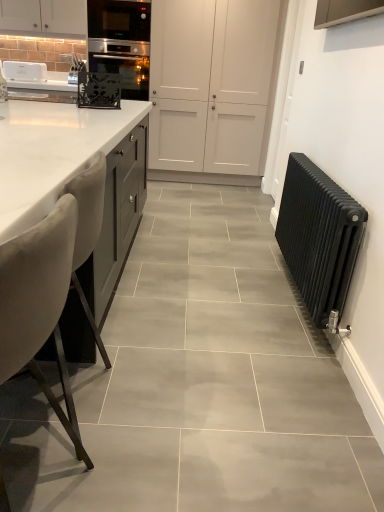
In order to face velvet beige chair at left, should I rotate leftwards or rightwards?

Turn left by 23.535 degrees to look at velvet beige chair at left.

What is the approximate width of white marble countertop at left?

9.86 feet.

The width and height of the screenshot is (384, 512). In order to click on velvet beige chair at left in this screenshot , I will do `click(37, 298)`.

Is white marble countertop at left inside or outside of velvet beige chair at left?

The correct answer is: outside.

Can you confirm if white marble countertop at left is thinner than velvet beige chair at left?

No.

Which is more distant, (195, 142) or (73, 133)?

The point (195, 142) is more distant.

Based on the photo, from a real-world perspective, which object stands above the other?

white matte cabinet at upper center is physically above.

Where is `cabinetry above the white marble countertop at left (from the image's perspective)`? The width and height of the screenshot is (384, 512). cabinetry above the white marble countertop at left (from the image's perspective) is located at coordinates (210, 88).

What's the angular difference between black cast iron radiator at right and velvet beige chair at left's facing directions?

They differ by 1.12 degrees in their facing directions.

Between black cast iron radiator at right and velvet beige chair at left, which one has smaller width?

black cast iron radiator at right.

Based on their positions, is black cast iron radiator at right located to the left or right of velvet beige chair at left?

Based on their positions, black cast iron radiator at right is located to the right of velvet beige chair at left.

From a real-world perspective, is black cast iron radiator at right on velvet beige chair at left?

Actually, black cast iron radiator at right is physically below velvet beige chair at left in the real world.

Where is `radiator on the right of white matte cabinet at upper center`? The height and width of the screenshot is (512, 384). radiator on the right of white matte cabinet at upper center is located at coordinates (319, 237).

From the image's perspective, which is above, black cast iron radiator at right or white matte cabinet at upper center?

white matte cabinet at upper center, from the image's perspective.

Does black cast iron radiator at right have a greater height compared to white matte cabinet at upper center?

A: In fact, black cast iron radiator at right may be shorter than white matte cabinet at upper center.

Considering the relative sizes of black cast iron radiator at right and white matte cabinet at upper center in the image provided, is black cast iron radiator at right bigger than white matte cabinet at upper center?

Incorrect, black cast iron radiator at right is not larger than white matte cabinet at upper center.

From the image's perspective, is white matte cabinet at upper center located beneath velvet beige chair at left?

No, from the image's perspective, white matte cabinet at upper center is not below velvet beige chair at left.

Is white matte cabinet at upper center not close to velvet beige chair at left?

Yes.

Looking at the image, does white matte cabinet at upper center seem bigger or smaller compared to velvet beige chair at left?

white matte cabinet at upper center is bigger than velvet beige chair at left.

Based on their positions, is white matte cabinet at upper center located to the left or right of velvet beige chair at left?

From the image, it's evident that white matte cabinet at upper center is to the right of velvet beige chair at left.

How different are the orientations of velvet beige chair at left and white matte cabinet at upper center in degrees?

The facing directions of velvet beige chair at left and white matte cabinet at upper center are 90.8 degrees apart.

From the image's perspective, is velvet beige chair at left positioned above or below white matte cabinet at upper center?

velvet beige chair at left is below white matte cabinet at upper center.

Is velvet beige chair at left positioned far away from white matte cabinet at upper center?

Indeed, velvet beige chair at left is not near white matte cabinet at upper center.

Does velvet beige chair at left have a larger size compared to white matte cabinet at upper center?

Actually, velvet beige chair at left might be smaller than white matte cabinet at upper center.

Locate an element on the screen. The image size is (384, 512). cabinetry on the right of the white marble countertop at left is located at coordinates (210, 88).

From the image's perspective, which is above, white marble countertop at left or white matte cabinet at upper center?

white matte cabinet at upper center.

Considering the relative sizes of white marble countertop at left and white matte cabinet at upper center in the image provided, is white marble countertop at left wider than white matte cabinet at upper center?

Yes, white marble countertop at left is wider than white matte cabinet at upper center.

The width and height of the screenshot is (384, 512). I want to click on countertop lying on the left of velvet beige chair at left, so click(x=51, y=153).

In the image, there is a white matte cabinet at upper center. At what (x,y) coordinates should I click in order to perform the action: click on countertop below it (from a real-world perspective). Please return your answer as a coordinate pair (x, y). Looking at the image, I should click on (51, 153).

Which object lies nearer to the anchor point black cast iron radiator at right, white matte cabinet at upper center or white marble countertop at left?

white marble countertop at left lies closer to black cast iron radiator at right than the other object.

Looking at the image, which one is located further to white marble countertop at left, black cast iron radiator at right or white matte cabinet at upper center?

Among the two, white matte cabinet at upper center is located further to white marble countertop at left.

Considering their positions, is black cast iron radiator at right positioned further to white matte cabinet at upper center than white marble countertop at left?

black cast iron radiator at right lies further to white matte cabinet at upper center than the other object.

When comparing their distances from white matte cabinet at upper center, does white marble countertop at left or black cast iron radiator at right seem further?

The object further to white matte cabinet at upper center is black cast iron radiator at right.

Looking at the image, which one is located closer to velvet beige chair at left, black cast iron radiator at right or white matte cabinet at upper center?

black cast iron radiator at right is closer to velvet beige chair at left.

Considering their positions, is velvet beige chair at left positioned closer to white matte cabinet at upper center than white marble countertop at left?

The object closer to white matte cabinet at upper center is white marble countertop at left.

Based on their spatial positions, is velvet beige chair at left or black cast iron radiator at right closer to white marble countertop at left?

Based on the image, velvet beige chair at left appears to be nearer to white marble countertop at left.

Based on the photo, when comparing their distances from velvet beige chair at left, does white marble countertop at left or black cast iron radiator at right seem further?

Among the two, black cast iron radiator at right is located further to velvet beige chair at left.

The width and height of the screenshot is (384, 512). I want to click on radiator between velvet beige chair at left and white matte cabinet at upper center from front to back, so tap(319, 237).

Find the location of `chair between white marble countertop at left and black cast iron radiator at right in the horizontal direction`. chair between white marble countertop at left and black cast iron radiator at right in the horizontal direction is located at coordinates (37, 298).

Where is `radiator between white marble countertop at left and white matte cabinet at upper center from front to back`? radiator between white marble countertop at left and white matte cabinet at upper center from front to back is located at coordinates (319, 237).

The width and height of the screenshot is (384, 512). Identify the location of countertop positioned between velvet beige chair at left and white matte cabinet at upper center from near to far. (51, 153).